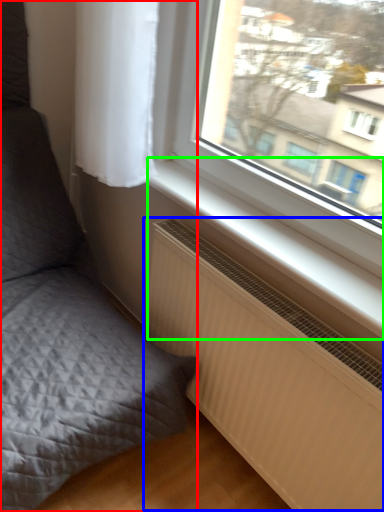
Question: Which object is the closest to the furniture (highlighted by a red box)? Choose among these: radiator (highlighted by a blue box) or window sill (highlighted by a green box).

Choices:
 (A) radiator
 (B) window sill

Answer: (A)